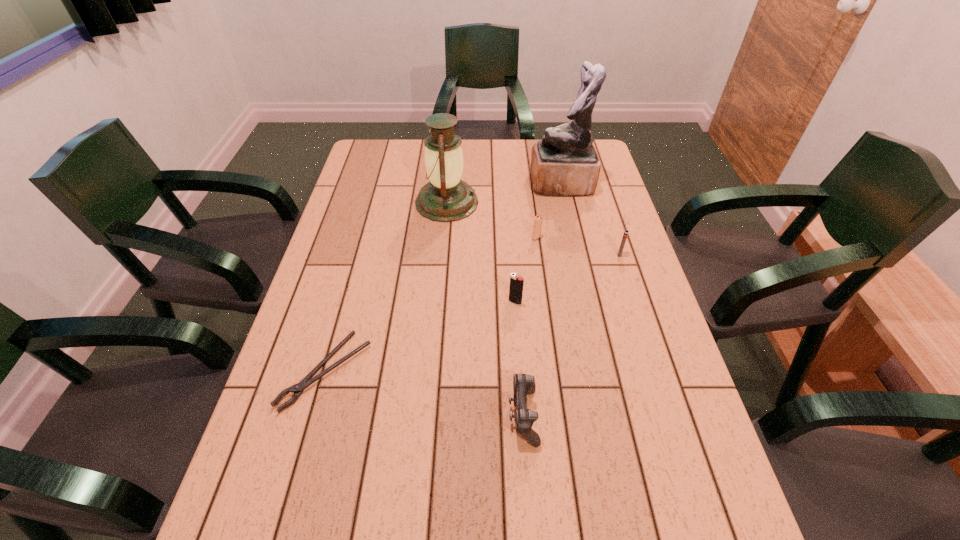
You are a GUI agent. You are given a task and a screenshot of the screen. Output one action in this format:
    pyautogui.click(x=<x>, y=<y>)
    Task: Click on the vacant area situated 0.380m on the front of the second nearest igniter
    The image size is (960, 540).
    Given the screenshot: What is the action you would take?
    pyautogui.click(x=658, y=373)

The image size is (960, 540). I want to click on vacant space located 0.270m on the left of the farthest igniter, so click(442, 238).

Locate an element on the screen. The width and height of the screenshot is (960, 540). vacant space located 0.060m on the back of the leftmost object is located at coordinates 342,314.

Where is `object that is at the far edge`? This screenshot has height=540, width=960. object that is at the far edge is located at coordinates (564, 163).

Locate an element on the screen. The height and width of the screenshot is (540, 960). object at the left edge is located at coordinates (297, 389).

Locate an element on the screen. sculpture positioned at the right edge is located at coordinates (564, 163).

Where is `igniter positioned at the right edge`? This screenshot has height=540, width=960. igniter positioned at the right edge is located at coordinates (626, 232).

Locate an element on the screen. This screenshot has height=540, width=960. object located in the far right corner section of the desktop is located at coordinates (564, 163).

Locate an element on the screen. This screenshot has width=960, height=540. free space at the far edge of the desktop is located at coordinates (477, 159).

In the image, there is a desktop. Identify the location of blank space at the left edge. Image resolution: width=960 pixels, height=540 pixels. (344, 212).